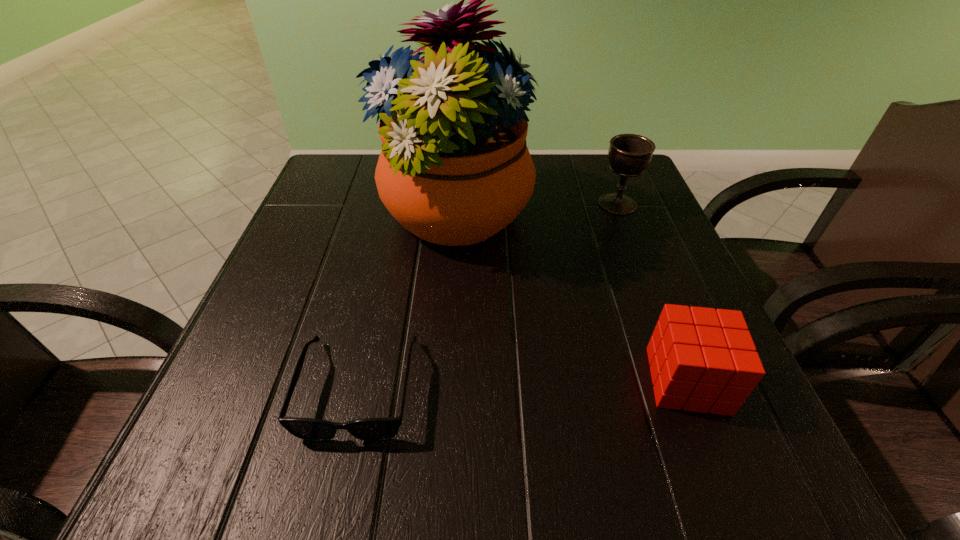
Find the location of a particular element. This screenshot has height=540, width=960. object positioned at the near edge is located at coordinates (384, 428).

At what (x,y) coordinates should I click in order to perform the action: click on object positioned at the left edge. Please return your answer as a coordinate pair (x, y). Looking at the image, I should click on (384, 428).

I want to click on chalice that is at the right edge, so click(629, 155).

Image resolution: width=960 pixels, height=540 pixels. Find the location of `cube at the right edge`. cube at the right edge is located at coordinates (704, 360).

This screenshot has height=540, width=960. In order to click on object present at the near left corner in this screenshot , I will do `click(384, 428)`.

This screenshot has height=540, width=960. Identify the location of object at the far right corner. (629, 155).

The width and height of the screenshot is (960, 540). I want to click on vacant space at the far edge of the desktop, so click(562, 163).

Identify the location of free space at the near edge. The width and height of the screenshot is (960, 540). (351, 441).

This screenshot has height=540, width=960. Find the location of `vacant space at the left edge`. vacant space at the left edge is located at coordinates (276, 306).

I want to click on free space at the right edge, so click(652, 309).